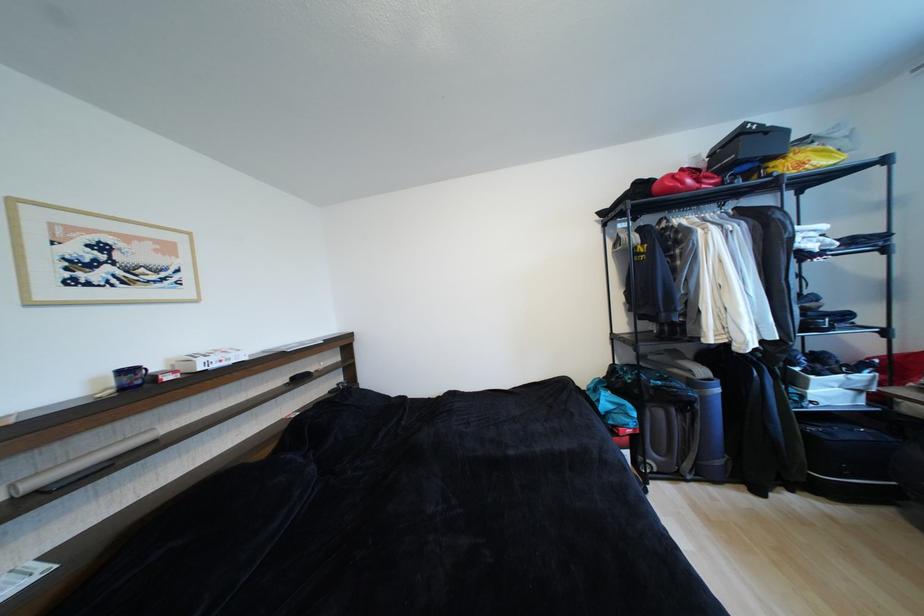
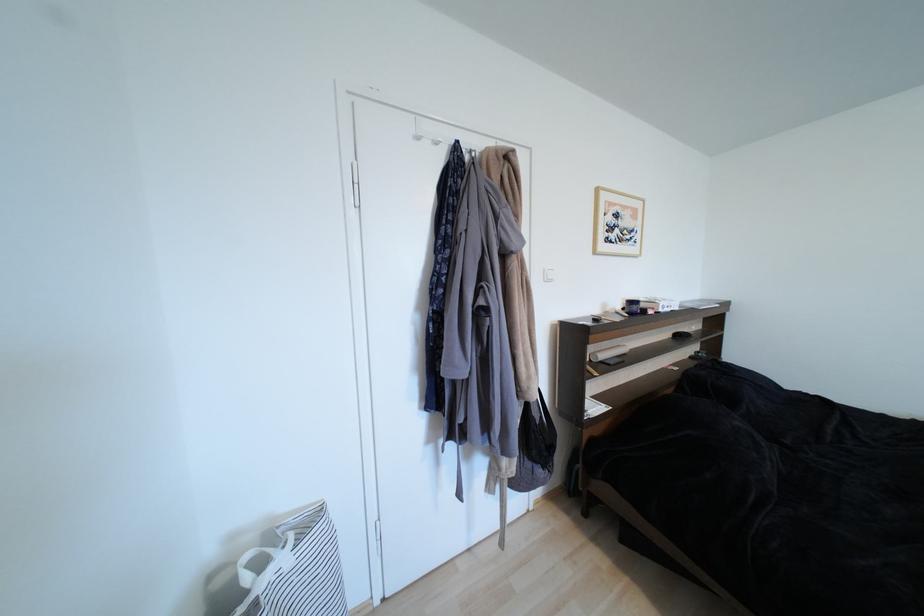
The point at (134, 373) is marked in the first image. Where is the corresponding point in the second image?

(638, 304)